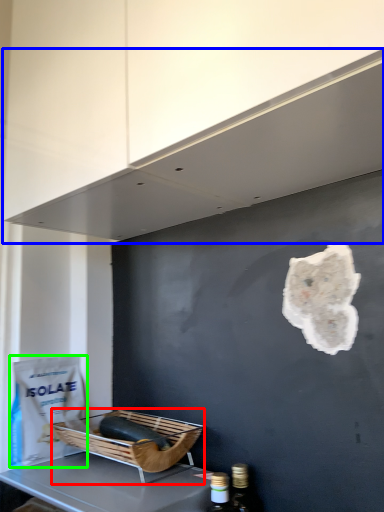
Question: Based on their relative distances, which object is nearer to basket (highlighted by a red box)? Choose from exhaust hood (highlighted by a blue box) and paper bag (highlighted by a green box).

Choices:
 (A) exhaust hood
 (B) paper bag

Answer: (B)